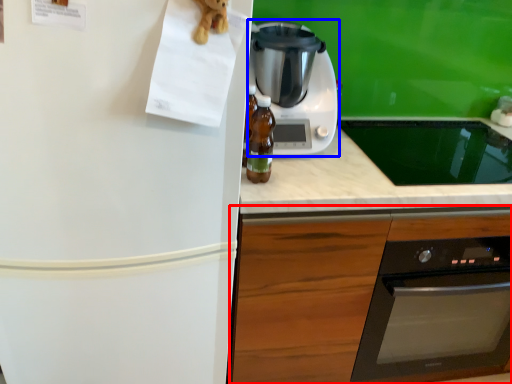
Question: Which of the following is the closest to the observer, cabinetry (highlighted by a red box) or kitchen appliance (highlighted by a blue box)?

Choices:
 (A) cabinetry
 (B) kitchen appliance

Answer: (A)